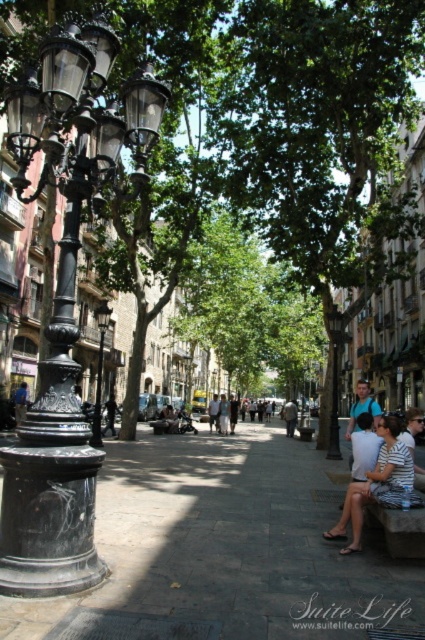
Is blue fabric shirt at center above blue denim jeans at center?

No, blue fabric shirt at center is not above blue denim jeans at center.

Is blue fabric shirt at center below blue denim jeans at center?

Yes.

Does point (373, 410) lie behind point (17, 392)?

That is False.

Find the location of `blue fabric shirt at center`. blue fabric shirt at center is located at coordinates (362, 406).

This screenshot has height=640, width=425. What do you see at coordinates (377, 484) in the screenshot?
I see `striped fabric couple at center` at bounding box center [377, 484].

What do you see at coordinates (377, 484) in the screenshot? I see `striped fabric couple at center` at bounding box center [377, 484].

In order to click on striped fabric couple at center in this screenshot , I will do `click(377, 484)`.

Can you confirm if dark gray stone pavement at center is positioned below blue fabric shirt at center?

Actually, dark gray stone pavement at center is above blue fabric shirt at center.

Locate an element on the screen. The width and height of the screenshot is (425, 640). dark gray stone pavement at center is located at coordinates (223, 548).